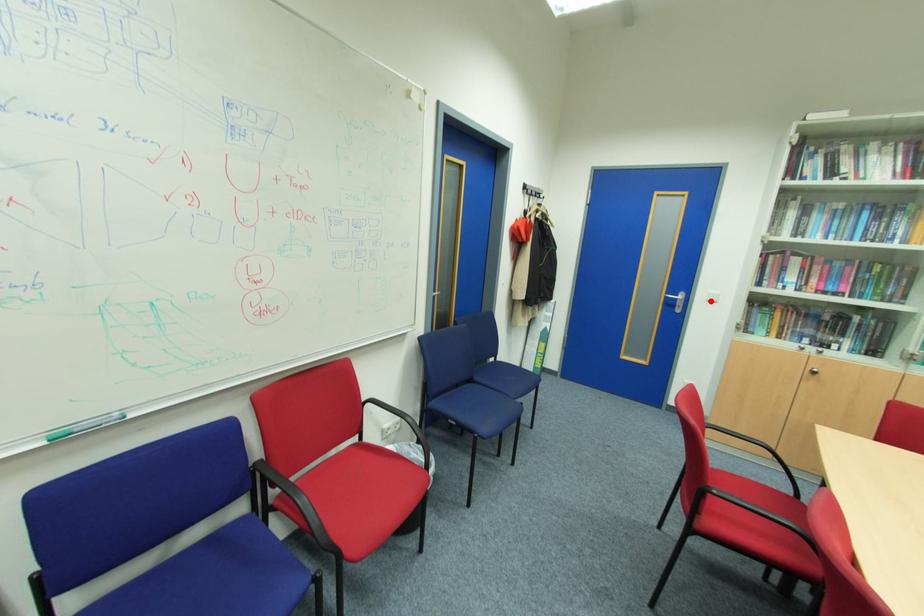
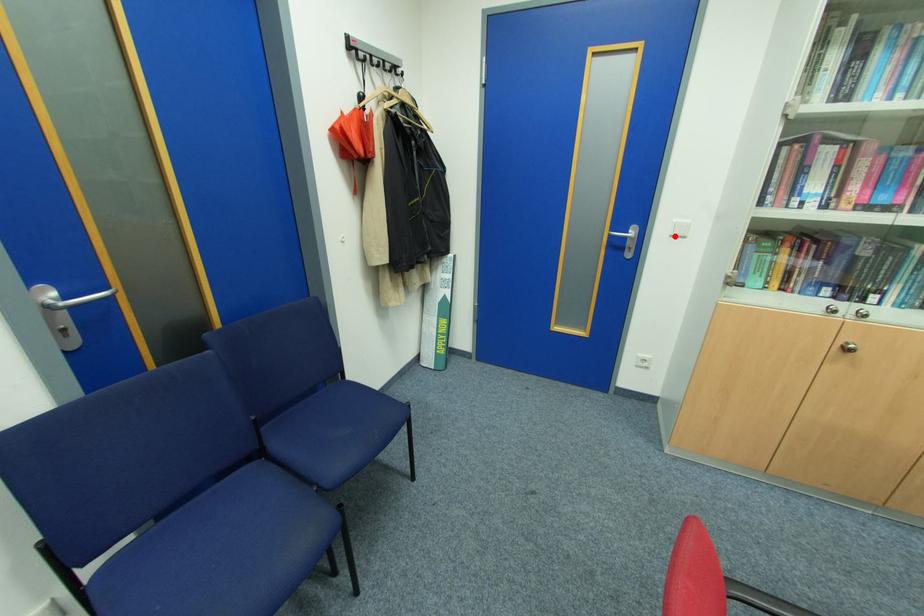
I am providing you with two images of the same scene from different viewpoints. A red point is marked on the first image and another point is marked on the second image. Is the red point in image1 aligned with the point shown in image2?

Yes